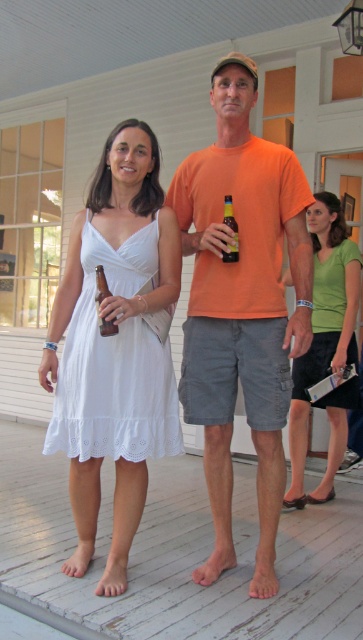
Is the position of orange cotton t-shirt at center more distant than that of brown glass bottle at center?

Yes, it is.

Can you confirm if orange cotton t-shirt at center is wider than brown glass bottle at center?

Yes, orange cotton t-shirt at center is wider than brown glass bottle at center.

Does point (274, 353) lie in front of point (96, 310)?

No, it is behind (96, 310).

You are a GUI agent. You are given a task and a screenshot of the screen. Output one action in this format:
    pyautogui.click(x=<x>, y=<y>)
    Task: Click on the orange cotton t-shirt at center
    
    Given the screenshot: What is the action you would take?
    pyautogui.click(x=242, y=305)

Can you confirm if white lace dress at center is taller than translucent glass bottle at center?

Yes.

Which is behind, point (128, 257) or point (226, 257)?

Point (128, 257)

Between point (153, 422) and point (231, 218), which one is positioned in front?

Positioned in front is point (231, 218).

Where is `white lace dress at center`? This screenshot has height=640, width=363. white lace dress at center is located at coordinates (116, 362).

Is green matte shirt at upper right shorter than translucent glass bottle at center?

In fact, green matte shirt at upper right may be taller than translucent glass bottle at center.

Between green matte shirt at upper right and translucent glass bottle at center, which one appears on the left side from the viewer's perspective?

translucent glass bottle at center

Is point (315, 346) positioned behind point (233, 224)?

Yes, it is behind point (233, 224).

Image resolution: width=363 pixels, height=640 pixels. Identify the location of green matte shirt at upper right. (325, 346).